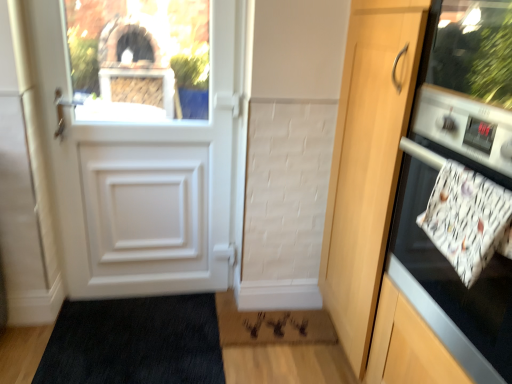
Question: Is point (394, 241) positioned closer to the camera than point (219, 302)?

Choices:
 (A) farther
 (B) closer

Answer: (B)

Question: From the image's perspective, is white glossy oven at right located above or below rug with textured pile at lower center?

Choices:
 (A) above
 (B) below

Answer: (A)

Question: Estimate the real-world distances between objects in this image. Which object is closer to the matte glass window screen at upper left?

Choices:
 (A) rug with textured pile at lower center
 (B) wooden door at right
 (C) white glossy oven at right

Answer: (B)

Question: Which object is the farthest from the rug with textured pile at lower center?

Choices:
 (A) wooden door at right
 (B) white glossy oven at right
 (C) matte glass window screen at upper left

Answer: (C)